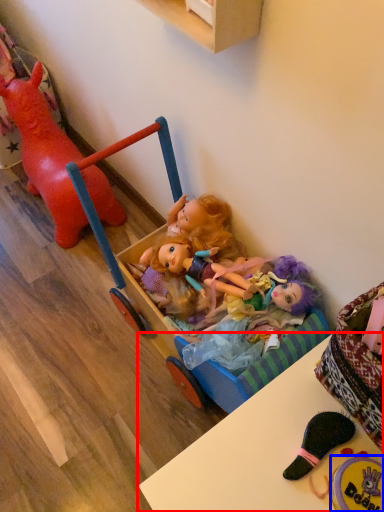
Question: Which of the following is the farthest to the observer, table (highlighted by a red box) or toy (highlighted by a blue box)?

Choices:
 (A) table
 (B) toy

Answer: (B)